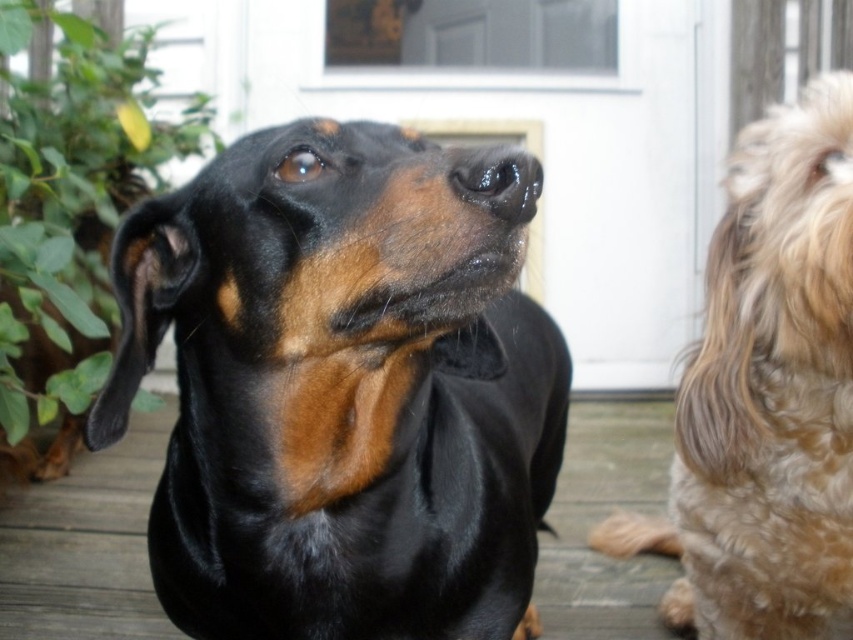
Question: Is the position of white matte screen door at upper center more distant than that of glossy black nose at center?

Choices:
 (A) no
 (B) yes

Answer: (B)

Question: Does white matte screen door at upper center have a larger size compared to black smooth deck at center?

Choices:
 (A) no
 (B) yes

Answer: (B)

Question: Among these points, which one is nearest to the camera?

Choices:
 (A) (402, 364)
 (B) (715, 531)
 (C) (509, 166)
 (D) (24, 492)

Answer: (C)

Question: Is black shiny dog at center in front of white matte screen door at upper center?

Choices:
 (A) no
 (B) yes

Answer: (B)

Question: Which object is farther from the camera taking this photo?

Choices:
 (A) glossy black nose at center
 (B) black smooth deck at center
 (C) white matte screen door at upper center

Answer: (C)

Question: Which object appears farthest from the camera in this image?

Choices:
 (A) shaggy golden-brown fur at right
 (B) glossy black nose at center
 (C) black smooth deck at center
 (D) black shiny dog at center

Answer: (C)